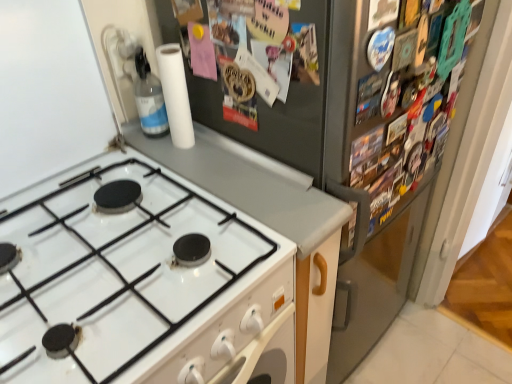
In order to face white matte paper towel at upper center, should I rotate leftwards or rightwards?

Turn left approximately 10.999 degrees to face it.

Measure the distance between point (411, 63) and camera.

Point (411, 63) and camera are 31.14 inches apart.

Where is `white matte paper towel at upper center`? The width and height of the screenshot is (512, 384). white matte paper towel at upper center is located at coordinates (175, 95).

Considering the sizes of objects white glossy gas stove at lower left and white matte countertop at center in the image provided, who is wider, white glossy gas stove at lower left or white matte countertop at center?

white glossy gas stove at lower left.

Is white glossy gas stove at lower left completely or partially outside of white matte countertop at center?

white glossy gas stove at lower left lies outside white matte countertop at center's area.

Does white glossy gas stove at lower left have a smaller size compared to white matte countertop at center?

Correct, white glossy gas stove at lower left occupies less space than white matte countertop at center.

Does transparent plastic bottle at upper left turn towards white matte countertop at center?

No, transparent plastic bottle at upper left is not oriented towards white matte countertop at center.

Considering the points (153, 92) and (287, 237), which point is behind, point (153, 92) or point (287, 237)?

The point (153, 92) is behind.

Can you confirm if transparent plastic bottle at upper left is positioned to the right of white matte countertop at center?

Incorrect, transparent plastic bottle at upper left is not on the right side of white matte countertop at center.

The height and width of the screenshot is (384, 512). Identify the location of bottle that is on the left side of white matte countertop at center. (149, 98).

From the image's perspective, is white matte paper towel at upper center below white matte countertop at center?

No, from the image's perspective, white matte paper towel at upper center is not beneath white matte countertop at center.

Looking at the image, does white matte paper towel at upper center seem bigger or smaller compared to white matte countertop at center?

Clearly, white matte paper towel at upper center is smaller in size than white matte countertop at center.

Is point (184, 79) positioned after point (255, 200)?

Yes, point (184, 79) is behind point (255, 200).

Which of these two, white matte paper towel at upper center or white matte countertop at center, is thinner?

white matte paper towel at upper center is thinner.

From a real-world perspective, is transparent plastic bottle at upper left located beneath satin silver fridge at upper right?

Actually, transparent plastic bottle at upper left is physically above satin silver fridge at upper right in the real world.

Which object is thinner, transparent plastic bottle at upper left or satin silver fridge at upper right?

Thinner between the two is transparent plastic bottle at upper left.

Based on the photo, is transparent plastic bottle at upper left next to satin silver fridge at upper right and touching it?

No, transparent plastic bottle at upper left is not in contact with satin silver fridge at upper right.

In the image, there is a transparent plastic bottle at upper left. In order to click on fridge below it (from a real-world perspective) in this screenshot , I will do `click(264, 74)`.

From a real-world perspective, is white matte countertop at center above or below white glossy gas stove at lower left?

Clearly, from a real-world perspective, white matte countertop at center is below white glossy gas stove at lower left.

Identify the location of gas stove lying in front of the white matte countertop at center. (141, 286).

Which object is more forward, white matte countertop at center or white glossy gas stove at lower left?

white glossy gas stove at lower left is more forward.

Looking at this image, considering the relative sizes of white matte countertop at center and white glossy gas stove at lower left in the image provided, is white matte countertop at center thinner than white glossy gas stove at lower left?

Yes.

Does satin silver fridge at upper right turn towards white matte countertop at center?

No, satin silver fridge at upper right is not turned towards white matte countertop at center.

Which is correct: satin silver fridge at upper right is inside white matte countertop at center, or outside of it?

satin silver fridge at upper right is spatially situated outside white matte countertop at center.

From the picture: Does satin silver fridge at upper right have a greater width compared to white matte countertop at center?

Indeed, satin silver fridge at upper right has a greater width compared to white matte countertop at center.

From the picture: Is satin silver fridge at upper right at the right side of white matte countertop at center?

Correct, you'll find satin silver fridge at upper right to the right of white matte countertop at center.

From the image's perspective, which one is positioned higher, white matte countertop at center or transparent plastic bottle at upper left?

From the image's view, transparent plastic bottle at upper left is above.

Considering the positions of objects white matte countertop at center and transparent plastic bottle at upper left in the image provided, who is behind, white matte countertop at center or transparent plastic bottle at upper left?

transparent plastic bottle at upper left is further away from the camera.

Is white matte countertop at center thinner than transparent plastic bottle at upper left?

In fact, white matte countertop at center might be wider than transparent plastic bottle at upper left.

You are a GUI agent. You are given a task and a screenshot of the screen. Output one action in this format:
    pyautogui.click(x=<x>, y=<y>)
    Task: Click on the bottle above the white matte countertop at center (from a real-world perspective)
    Image resolution: width=512 pixels, height=384 pixels.
    Given the screenshot: What is the action you would take?
    pyautogui.click(x=149, y=98)

Find the location of a particular element. counter top lying behind the white glossy gas stove at lower left is located at coordinates (250, 184).

You are a GUI agent. You are given a task and a screenshot of the screen. Output one action in this format:
    pyautogui.click(x=<x>, y=<y>)
    Task: Click on the bottle located above the white matte countertop at center (from a real-world perspective)
    Image resolution: width=512 pixels, height=384 pixels.
    Given the screenshot: What is the action you would take?
    pyautogui.click(x=149, y=98)

When comparing their distances from white glossy gas stove at lower left, does white matte paper towel at upper center or transparent plastic bottle at upper left seem closer?

white matte paper towel at upper center is closer to white glossy gas stove at lower left.

From the picture: From the image, which object appears to be farther from white matte countertop at center, transparent plastic bottle at upper left or satin silver fridge at upper right?

The object further to white matte countertop at center is transparent plastic bottle at upper left.

Looking at the image, which one is located closer to satin silver fridge at upper right, white matte countertop at center or transparent plastic bottle at upper left?

white matte countertop at center is positioned closer to the anchor satin silver fridge at upper right.

Which object lies nearer to the anchor point white matte paper towel at upper center, transparent plastic bottle at upper left or satin silver fridge at upper right?

The object closer to white matte paper towel at upper center is transparent plastic bottle at upper left.

Based on the photo, estimate the real-world distances between objects in this image. Which object is further from white matte countertop at center, white matte paper towel at upper center or satin silver fridge at upper right?

satin silver fridge at upper right.

Based on their spatial positions, is transparent plastic bottle at upper left or white glossy gas stove at lower left closer to white matte paper towel at upper center?

transparent plastic bottle at upper left lies closer to white matte paper towel at upper center than the other object.

From the image, which object appears to be nearer to white matte countertop at center, satin silver fridge at upper right or white matte paper towel at upper center?

white matte paper towel at upper center is positioned closer to the anchor white matte countertop at center.

From the image, which object appears to be nearer to white matte countertop at center, transparent plastic bottle at upper left or white glossy gas stove at lower left?

white glossy gas stove at lower left lies closer to white matte countertop at center than the other object.

Locate an element on the screen. gas stove between transparent plastic bottle at upper left and white matte countertop at center vertically is located at coordinates (141, 286).

At what (x,y) coordinates should I click in order to perform the action: click on paper towel between transparent plastic bottle at upper left and white matte countertop at center from top to bottom. Please return your answer as a coordinate pair (x, y). The height and width of the screenshot is (384, 512). Looking at the image, I should click on (175, 95).

The height and width of the screenshot is (384, 512). In order to click on counter top between white glossy gas stove at lower left and satin silver fridge at upper right in the horizontal direction in this screenshot , I will do `click(250, 184)`.

You are a GUI agent. You are given a task and a screenshot of the screen. Output one action in this format:
    pyautogui.click(x=<x>, y=<y>)
    Task: Click on the paper towel between white glossy gas stove at lower left and transparent plastic bottle at upper left from front to back
    The width and height of the screenshot is (512, 384).
    Given the screenshot: What is the action you would take?
    pyautogui.click(x=175, y=95)